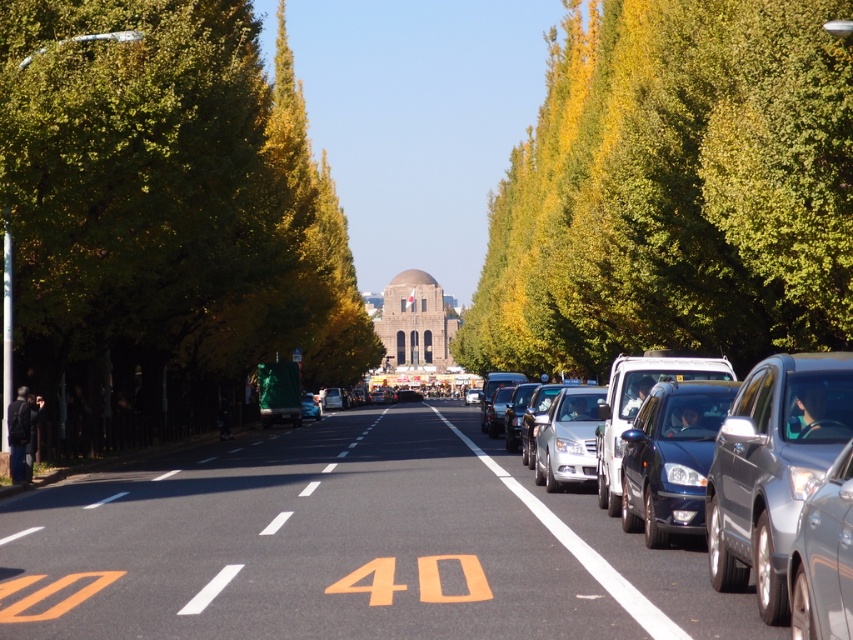
Question: Which object is farther from the camera taking this photo?

Choices:
 (A) sleek silver sedan at right
 (B) green leafy tree at right
 (C) satin silver sedan at center
 (D) green leafy tree at left

Answer: (D)

Question: Considering the real-world distances, which object is closest to the satin silver sedan at right?

Choices:
 (A) green leafy tree at left
 (B) sleek silver sedan at right

Answer: (B)

Question: Can you confirm if shiny silver sedan at right is bigger than satin silver sedan at right?

Choices:
 (A) no
 (B) yes

Answer: (A)

Question: Can you confirm if green leafy tree at left is positioned to the right of shiny silver sedan at right?

Choices:
 (A) no
 (B) yes

Answer: (A)

Question: Which is farther from the shiny blue sedan at right?

Choices:
 (A) satin silver sedan at center
 (B) satin silver sedan at right

Answer: (A)

Question: Can you confirm if sleek silver sedan at right is positioned to the left of satin silver sedan at center?

Choices:
 (A) yes
 (B) no

Answer: (B)